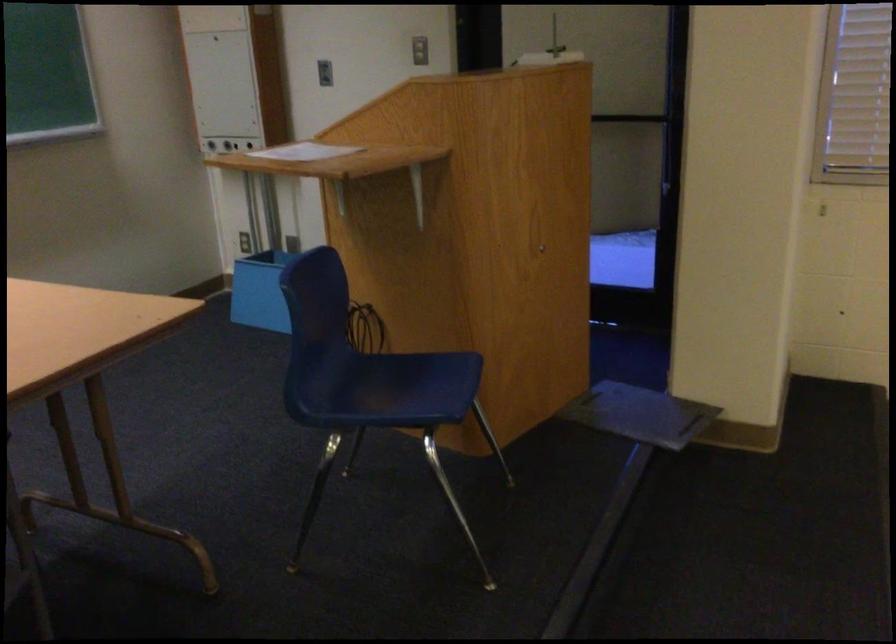
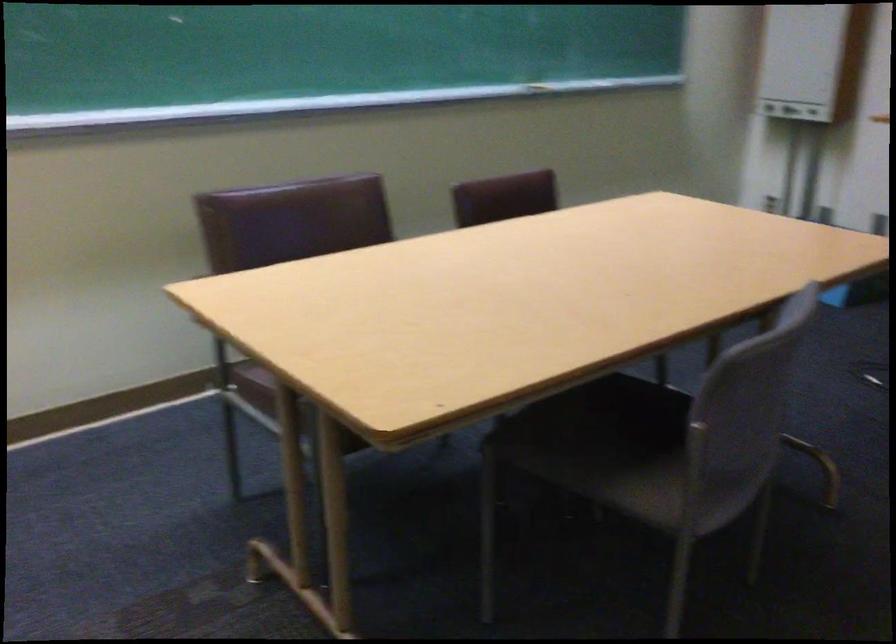
Question: The camera is either moving clockwise (left) or counter-clockwise (right) around the object. The first image is from the beginning of the video and the second image is from the end. Is the camera moving left or right when shooting the video?

Choices:
 (A) Left
 (B) Right

Answer: (B)